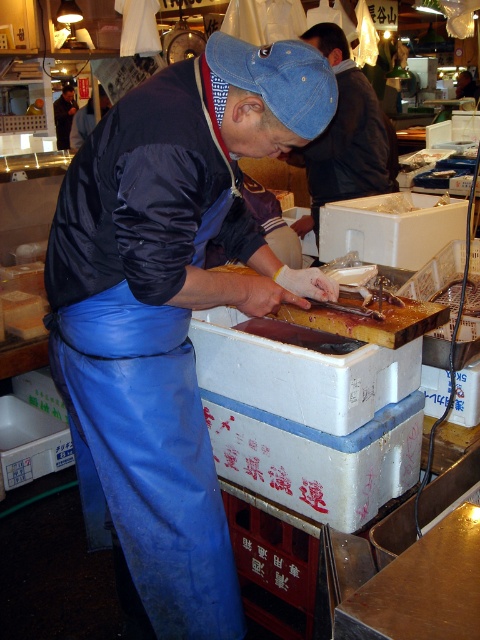
Question: Does blue denim cap at upper center appear on the right side of dark blue apron at lower left?

Choices:
 (A) yes
 (B) no

Answer: (A)

Question: Considering the relative positions of blue rubber apron at center and dark blue apron at lower left in the image provided, where is blue rubber apron at center located with respect to dark blue apron at lower left?

Choices:
 (A) above
 (B) below

Answer: (B)

Question: Estimate the real-world distances between objects in this image. Which object is closer to the blue rubber apron at center?

Choices:
 (A) dark blue apron at lower left
 (B) blue denim cap at upper center

Answer: (B)

Question: Can you confirm if blue denim cap at upper center is positioned above dark blue apron at lower left?

Choices:
 (A) no
 (B) yes

Answer: (A)

Question: Based on their relative distances, which object is farther from the blue rubber apron at center?

Choices:
 (A) dark blue apron at lower left
 (B) blue denim cap at upper center

Answer: (A)

Question: Which of these objects is positioned farthest from the blue denim cap at upper center?

Choices:
 (A) blue rubber apron at center
 (B) dark blue apron at lower left

Answer: (B)